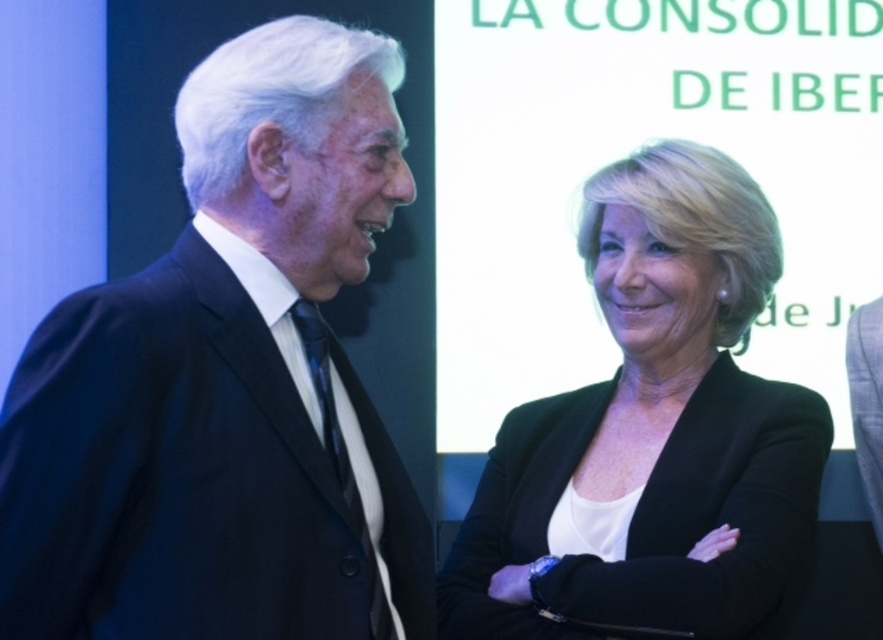
Question: Considering the relative positions of black matte suit at center and black matte blazer at center in the image provided, where is black matte suit at center located with respect to black matte blazer at center?

Choices:
 (A) left
 (B) right

Answer: (A)

Question: Does black matte suit at center come in front of light blue wool suit at right?

Choices:
 (A) yes
 (B) no

Answer: (A)

Question: Estimate the real-world distances between objects in this image. Which object is farther from the black matte suit at center?

Choices:
 (A) light blue wool suit at right
 (B) black matte blazer at center

Answer: (A)

Question: Which point is farther to the camera?

Choices:
 (A) (877, 422)
 (B) (192, 324)
 (C) (721, 234)

Answer: (A)

Question: Among these points, which one is nearest to the camera?

Choices:
 (A) (783, 458)
 (B) (192, 157)

Answer: (B)

Question: Can you confirm if black matte blazer at center is positioned above light blue wool suit at right?

Choices:
 (A) no
 (B) yes

Answer: (B)